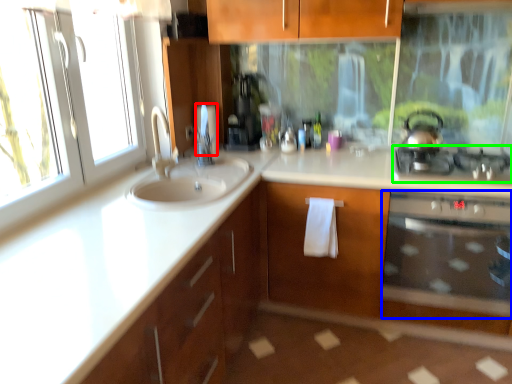
Question: Estimate the real-world distances between objects in this image. Which object is farther from toilet paper (highlighted by a red box), oven (highlighted by a blue box) or gas stove (highlighted by a green box)?

Choices:
 (A) oven
 (B) gas stove

Answer: (A)